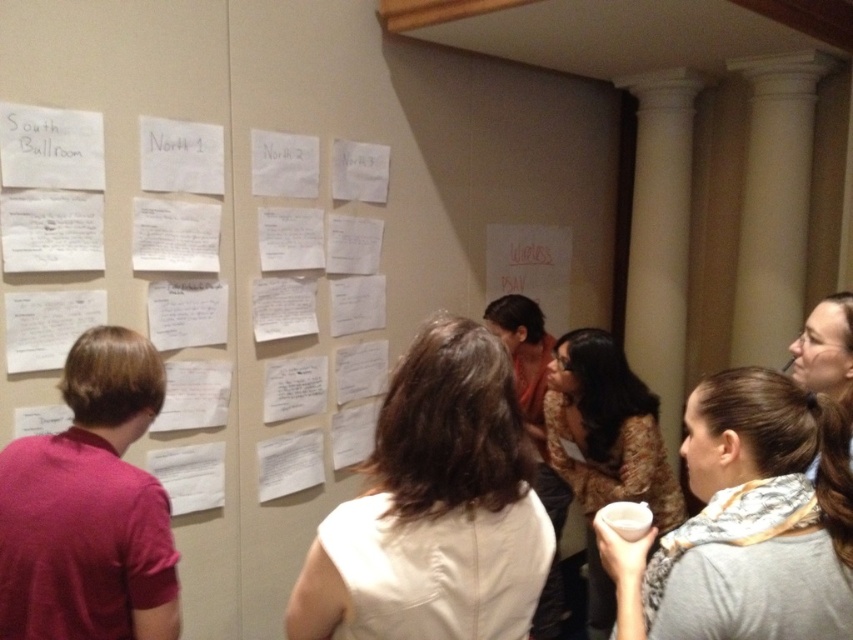
You are a guest at an event and you see the gray fabric scarf at lower right and the smooth brown hair at upper right. Which object is positioned higher up in the image?

The smooth brown hair at upper right is positioned higher up in the image than the gray fabric scarf at lower right.

You are standing in the room and want to find the white fabric shirt at center. Which direction should you look to locate it?

The white fabric shirt at center is located at point (434, 508), which is slightly to the right and middle of the room. You should look towards the center area slightly to the right.

You are a photographer standing in the room and want to capture a photo that includes both the gray fabric scarf at lower right and the smooth brown hair at upper right. Which object should you focus on first to ensure both are in frame?

You should focus on the gray fabric scarf at lower right first because it is positioned under the smooth brown hair at upper right, so adjusting the camera to include the lower object ensures the upper one is also captured.